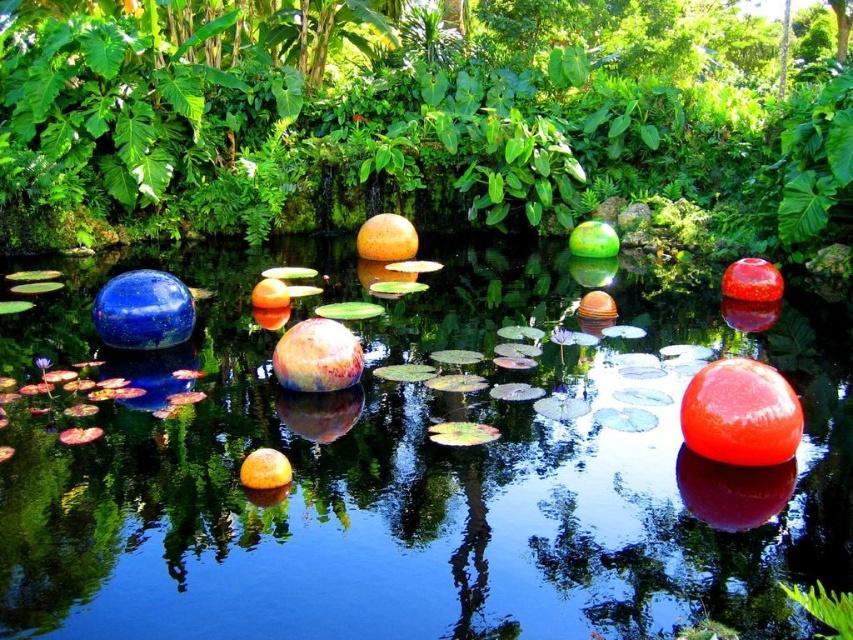
Question: Is transparent glass water at center thinner than green leafy tree at center?

Choices:
 (A) no
 (B) yes

Answer: (B)

Question: Where is transparent glass water at center located in relation to green leafy tree at center in the image?

Choices:
 (A) right
 (B) left

Answer: (B)

Question: Can you confirm if transparent glass water at center is bigger than green leafy tree at center?

Choices:
 (A) yes
 (B) no

Answer: (B)